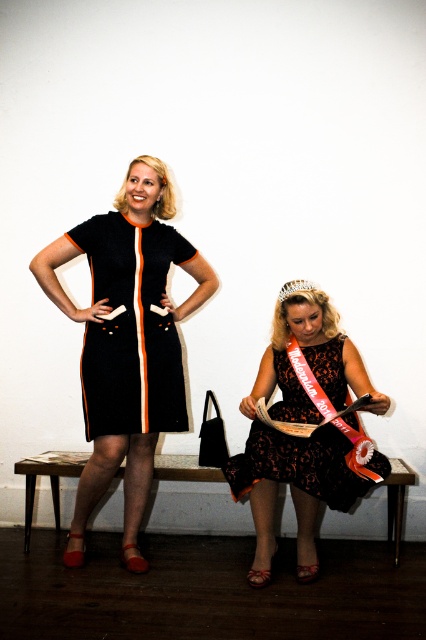
Which is below, black matte dress at upper left or clear crystal tiara at upper center?

black matte dress at upper left

What do you see at coordinates (131, 328) in the screenshot? Image resolution: width=426 pixels, height=640 pixels. I see `black matte dress at upper left` at bounding box center [131, 328].

Locate an element on the screen. black matte dress at upper left is located at coordinates (131, 328).

Does black matte dress at upper left appear on the left side of black lace dress at lower center?

Correct, you'll find black matte dress at upper left to the left of black lace dress at lower center.

Which of these two, black matte dress at upper left or black lace dress at lower center, stands shorter?

black lace dress at lower center

Which is behind, point (160, 337) or point (328, 426)?

Positioned behind is point (160, 337).

At what (x,y) coordinates should I click in order to perform the action: click on black matte dress at upper left. Please return your answer as a coordinate pair (x, y). Looking at the image, I should click on (131, 328).

Who is taller, matte black dress at center or black lace dress at lower center?

With more height is matte black dress at center.

Is point (74, 314) closer to camera compared to point (290, 468)?

No, it is not.

The height and width of the screenshot is (640, 426). What are the coordinates of `matte black dress at center` in the screenshot? It's located at (126, 342).